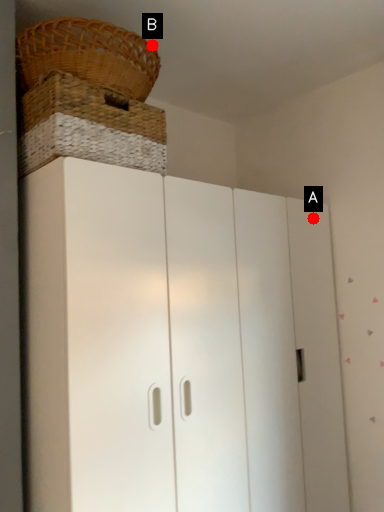
Question: Two points are circled on the image, labeled by A and B beside each circle. Which point appears farthest from the camera in this image?

Choices:
 (A) A is further
 (B) B is further

Answer: (A)